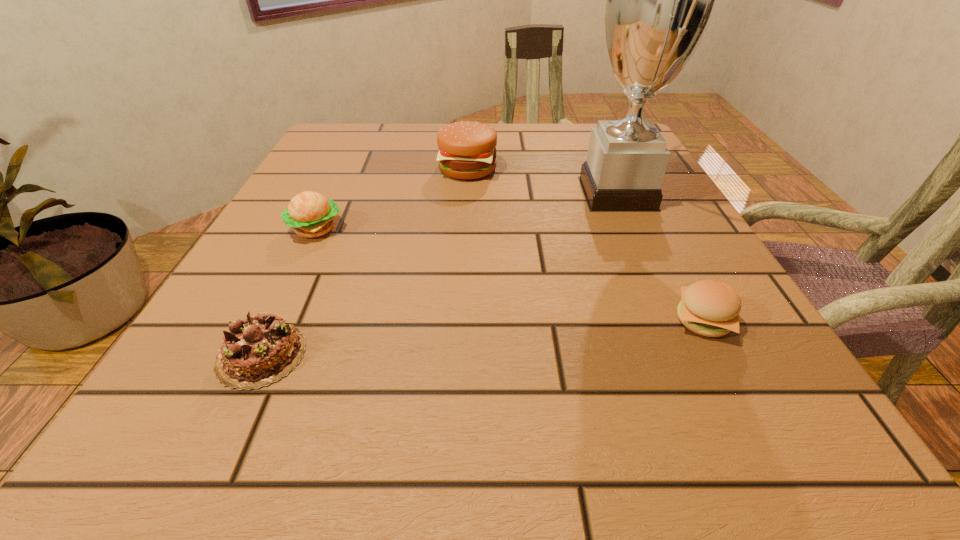
The height and width of the screenshot is (540, 960). Find the location of `vacant space at the far edge`. vacant space at the far edge is located at coordinates (540, 126).

You are a GUI agent. You are given a task and a screenshot of the screen. Output one action in this format:
    pyautogui.click(x=<x>, y=<y>)
    Task: Click on the vacant space at the left edge of the desktop
    This screenshot has height=540, width=960.
    Given the screenshot: What is the action you would take?
    pyautogui.click(x=312, y=266)

The width and height of the screenshot is (960, 540). I want to click on vacant space at the right edge of the desktop, so click(638, 252).

The height and width of the screenshot is (540, 960). I want to click on vacant space at the far left corner of the desktop, so click(333, 158).

This screenshot has height=540, width=960. Find the location of `vacant space at the near right corner`. vacant space at the near right corner is located at coordinates (682, 401).

I want to click on vacant area between the trophy cup and the rightmost hamburger, so click(x=660, y=257).

Locate an element on the screen. The image size is (960, 540). free space between the third object from right to left and the shortest object is located at coordinates (365, 261).

Locate an element on the screen. free space between the nearest hamburger and the leftmost hamburger is located at coordinates (509, 275).

Where is `vacant area between the shortest object and the nearest hamburger`? Image resolution: width=960 pixels, height=540 pixels. vacant area between the shortest object and the nearest hamburger is located at coordinates (482, 338).

In order to click on free space between the shortest object and the tallest hamburger in this screenshot , I will do `click(365, 261)`.